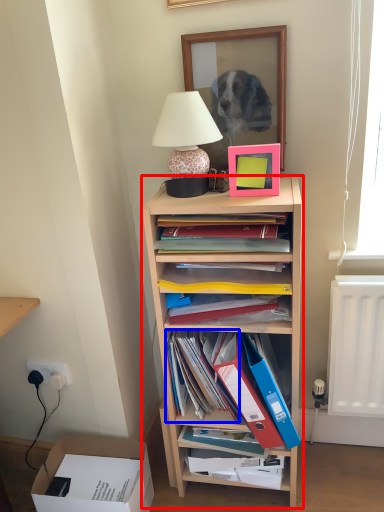
Question: Which of the following is the farthest to the observer, shelf (highlighted by a red box) or book (highlighted by a blue box)?

Choices:
 (A) shelf
 (B) book

Answer: (B)